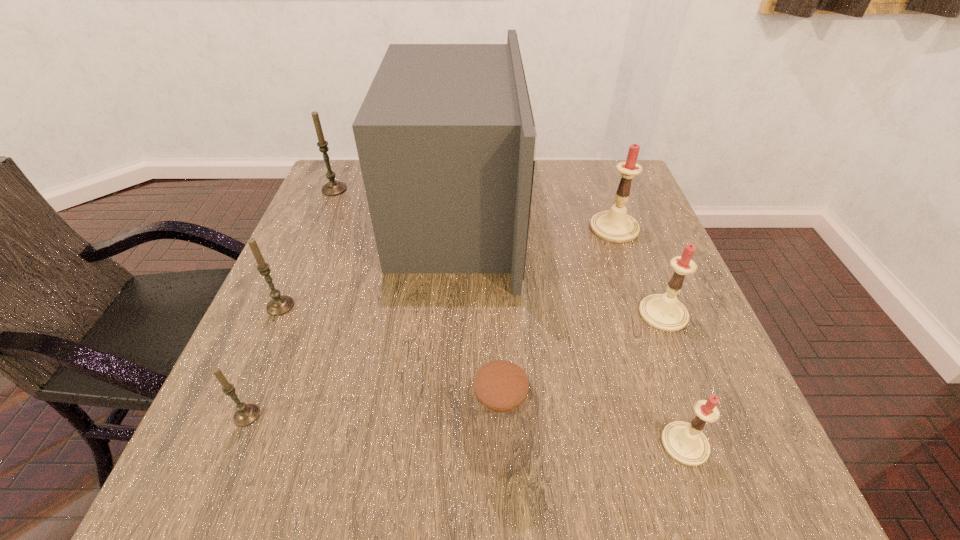
Identify the location of the tallest object. (446, 139).

At what (x,y) coordinates should I click in order to perform the action: click on gray microwave oven. Please return your answer as a coordinate pair (x, y). The image size is (960, 540). Looking at the image, I should click on (446, 139).

Locate an element on the screen. This screenshot has height=540, width=960. the farthest candle is located at coordinates (332, 188).

Image resolution: width=960 pixels, height=540 pixels. I want to click on the farthest gray candle, so click(332, 188).

Identify the location of the farthest red candle. (615, 225).

This screenshot has height=540, width=960. I want to click on the biggest red candle, so click(615, 225).

Locate an element on the screen. The width and height of the screenshot is (960, 540). the second nearest red candle is located at coordinates (664, 312).

Where is `the second biggest gray candle`? the second biggest gray candle is located at coordinates (279, 305).

Find the location of `brown jar`. brown jar is located at coordinates (499, 407).

Identify the location of the nearest gray candle. (246, 414).